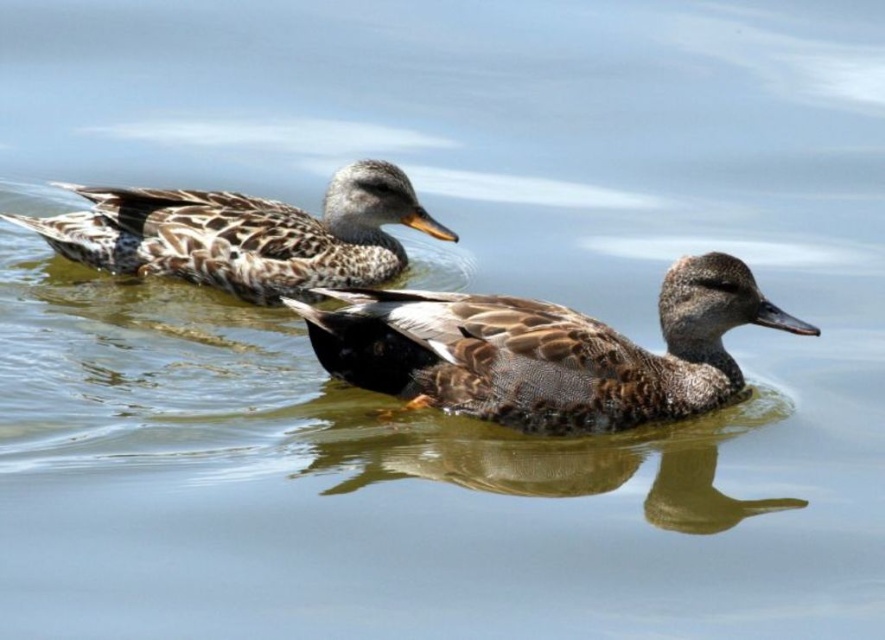
Question: Which object appears closest to the camera in this image?

Choices:
 (A) brown matte duck at center
 (B) speckled feathered duck at upper left

Answer: (A)

Question: In this image, where is brown matte duck at center located relative to speckled feathered duck at upper left?

Choices:
 (A) left
 (B) right

Answer: (B)

Question: Can you confirm if brown matte duck at center is positioned above speckled feathered duck at upper left?

Choices:
 (A) yes
 (B) no

Answer: (B)

Question: Which point is closer to the camera?

Choices:
 (A) (548, 419)
 (B) (383, 262)

Answer: (A)

Question: Does brown matte duck at center appear over speckled feathered duck at upper left?

Choices:
 (A) no
 (B) yes

Answer: (A)